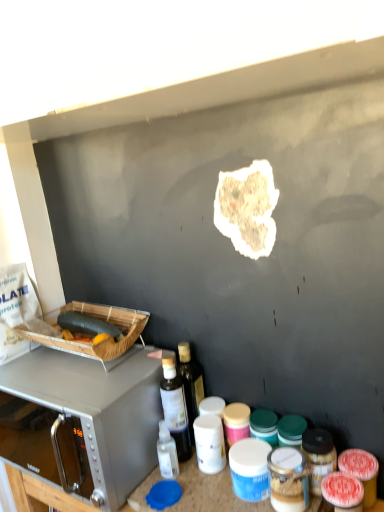
Identify the location of vacant area on top of satin silver microwave at upper left (from a real-world perspective). Image resolution: width=384 pixels, height=512 pixels. (61, 372).